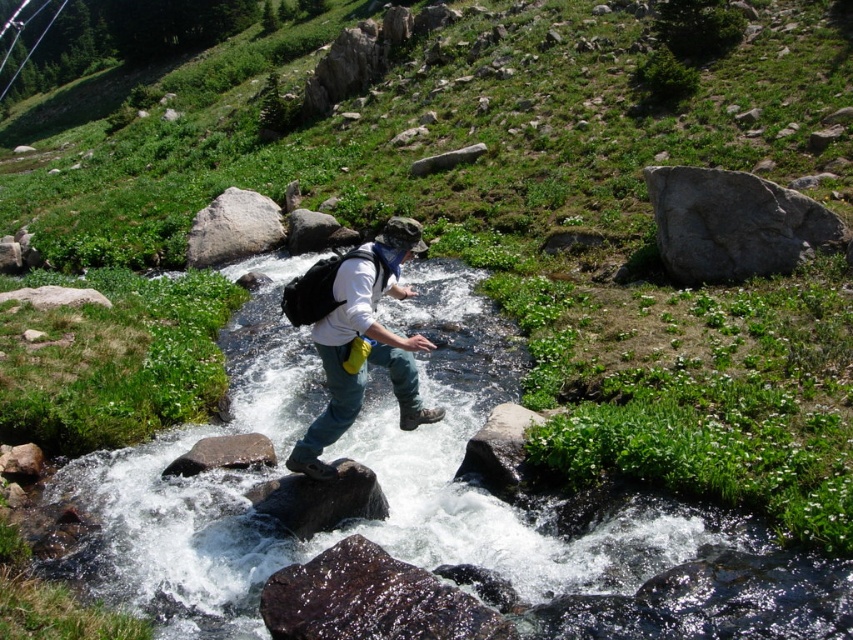
Question: Which of the following is the closest to the observer?

Choices:
 (A) clear water at center
 (B) smooth gray rock at center
 (C) white matte shirt at center
 (D) gray rough rock at center

Answer: (A)

Question: Which object is positioned closest to the gray smooth rock at center?

Choices:
 (A) smooth gray rock at center
 (B) white matte shirt at center

Answer: (B)

Question: Observing the image, what is the correct spatial positioning of dark gray rock at center in reference to gray smooth rock at center?

Choices:
 (A) above
 (B) below

Answer: (B)

Question: Does gray rough rock at upper right have a greater width compared to shiny dark rock at center?

Choices:
 (A) yes
 (B) no

Answer: (A)

Question: Which point appears closest to the camera in this image?

Choices:
 (A) (260, 288)
 (B) (231, 461)
 (C) (438, 164)
 (D) (763, 269)

Answer: (B)

Question: Is white matte shirt at center in front of shiny dark rock at center?

Choices:
 (A) yes
 (B) no

Answer: (B)